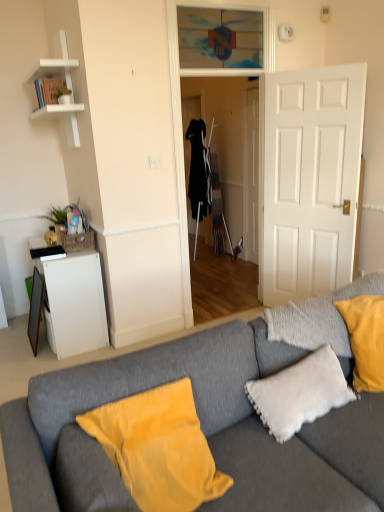
Question: In terms of size, does gray fabric couch at center appear bigger or smaller than transparent glass door at upper center?

Choices:
 (A) small
 (B) big

Answer: (B)

Question: Based on their positions, is gray fabric couch at center located to the left or right of transparent glass door at upper center?

Choices:
 (A) right
 (B) left

Answer: (A)

Question: Which object is the farthest from the transparent glass door at upper center?

Choices:
 (A) transparent glass door at center
 (B) white matte door at center
 (C) white matte cabinet at left
 (D) white matte shelf at upper left
 (E) velvet yellow pillow at lower center, placed as the second pillow when sorted from right to left

Answer: (E)

Question: Which is farther from the transparent glass door at center?

Choices:
 (A) green leafy plant at upper left
 (B) white matte cabinet at left
 (C) white matte shelf at upper left
 (D) gray fabric couch at center
 (E) white fluffy pillow at lower right, acting as the second pillow starting from the left

Answer: (D)